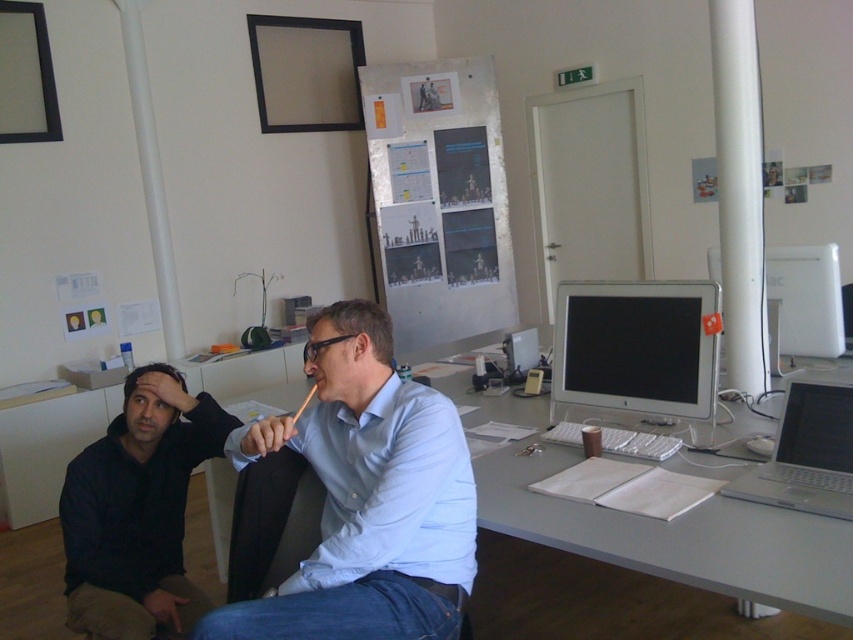
Question: Which of these objects is positioned closest to the white glossy computer monitor at right?

Choices:
 (A) light blue shirt at center
 (B) white glossy monitor at center
 (C) dark blue hoodie at lower left
 (D) silver metallic laptop at right

Answer: (B)

Question: Is dark blue hoodie at lower left above white glossy monitor at center?

Choices:
 (A) yes
 (B) no

Answer: (B)

Question: Which object appears farthest from the camera in this image?

Choices:
 (A) silver metallic laptop at right
 (B) light blue shirt at center

Answer: (A)

Question: Which object is positioned closest to the light blue shirt at center?

Choices:
 (A) white glossy computer monitor at right
 (B) white glossy monitor at center
 (C) dark blue hoodie at lower left

Answer: (C)

Question: From the image, what is the correct spatial relationship of light blue shirt at center in relation to white glossy monitor at center?

Choices:
 (A) above
 (B) below

Answer: (B)

Question: Where is light blue shirt at center located in relation to white glossy monitor at center in the image?

Choices:
 (A) above
 (B) below

Answer: (B)